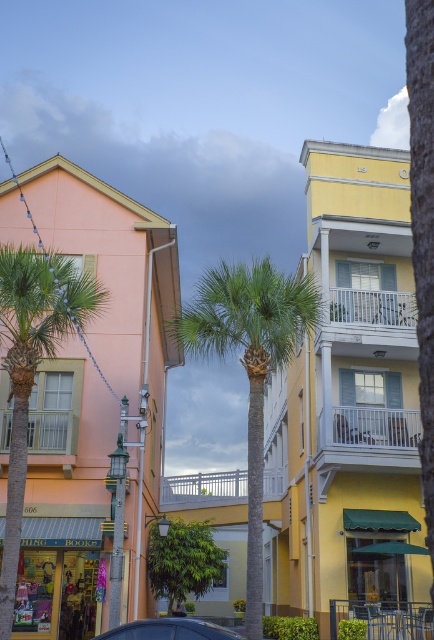
Who is taller, green leafy palm tree at center or blue glossy car at lower center?

green leafy palm tree at center is taller.

Find the location of `green leafy palm tree at center`. green leafy palm tree at center is located at coordinates (249, 365).

Describe the element at coordinates (249, 365) in the screenshot. I see `green leafy palm tree at center` at that location.

Where is `green leafy palm tree at center`? The image size is (434, 640). green leafy palm tree at center is located at coordinates (249, 365).

Is point (32, 352) positioned after point (224, 632)?

That is True.

Can you confirm if green leafy palm tree at left is bigger than blue glossy car at lower center?

Yes.

This screenshot has width=434, height=640. What do you see at coordinates (32, 365) in the screenshot?
I see `green leafy palm tree at left` at bounding box center [32, 365].

At what (x,y) coordinates should I click in order to perform the action: click on green leafy palm tree at left. Please return your answer as a coordinate pair (x, y). Image resolution: width=434 pixels, height=640 pixels. Looking at the image, I should click on point(32,365).

Is point (253, 413) positioned in front of point (13, 337)?

That is True.

How distant is green leafy palm tree at center from green leafy palm tree at left?

They are 69.18 feet apart.

Measure the distance between point (257, 401) and camera.

Point (257, 401) is 14.61 meters away from camera.

Find the location of a particular element. The width and height of the screenshot is (434, 640). green leafy palm tree at center is located at coordinates (249, 365).